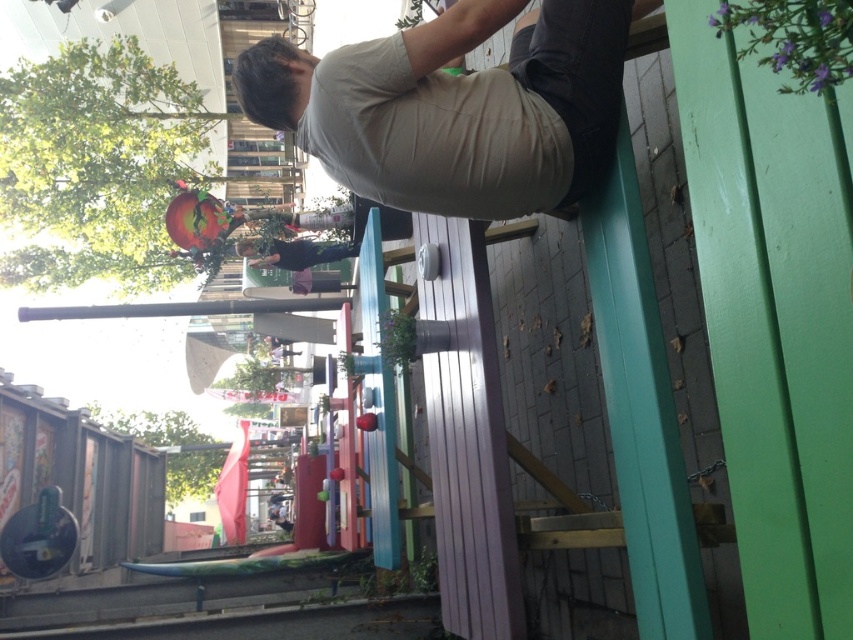
Does beige cotton shirt at upper center have a smaller size compared to matte black shirt at center?

No, beige cotton shirt at upper center is not smaller than matte black shirt at center.

Looking at this image, is beige cotton shirt at upper center thinner than matte black shirt at center?

No, beige cotton shirt at upper center is not thinner than matte black shirt at center.

Image resolution: width=853 pixels, height=640 pixels. What are the coordinates of `beige cotton shirt at upper center` in the screenshot? It's located at (456, 108).